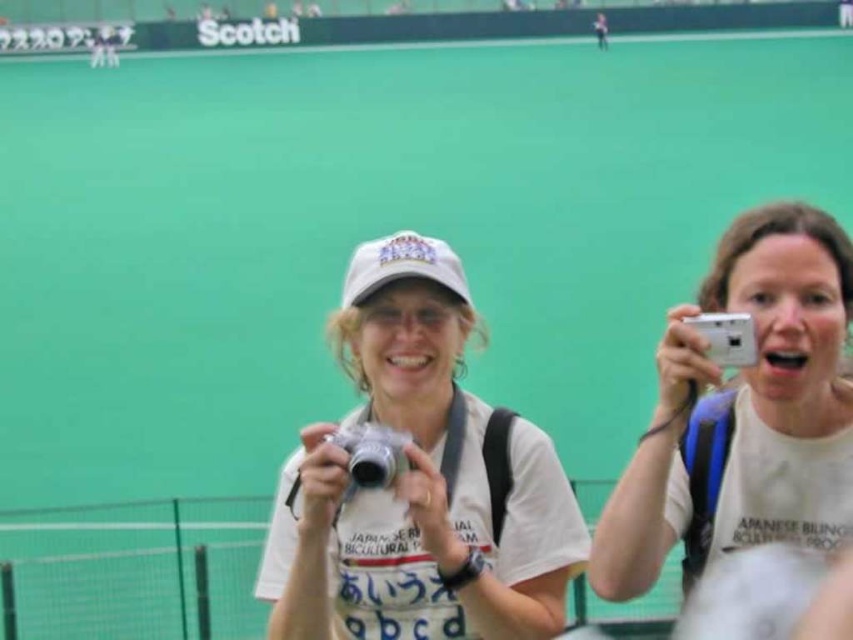
You are organizing a photography exhibition and need to display two cameras. The silver metallic camera at center and the white plastic camera at upper right. Which camera should you choose if you want to display the taller one?

The silver metallic camera at center is taller than the white plastic camera at upper right, so you should choose the silver metallic camera at center for the exhibition.

You are standing in front of the tennis court and see two points marked in the image. Which point, point (438, 572) or point (699, 324), is closer to you?

Point (438, 572) is closer to you because it is further to the viewer than point (699, 324).

You are a photographer at the tennis court. You see the white matte cap at center and the white plastic camera at right. Which object is located lower in the image?

The white matte cap at center is located lower than the white plastic camera at right in the image.